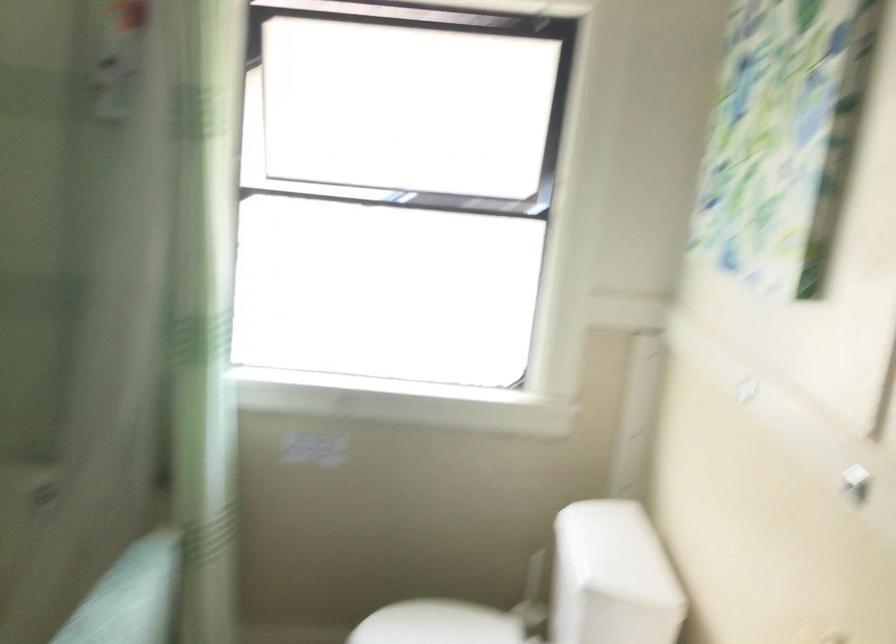
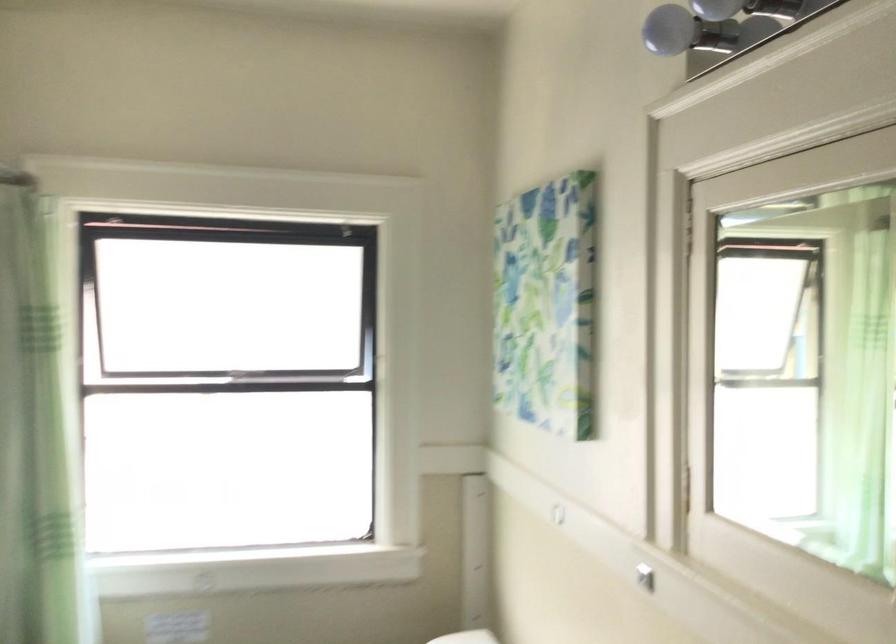
Question: How did the camera likely rotate?

Choices:
 (A) Left
 (B) Right
 (C) Up
 (D) Down

Answer: (B)